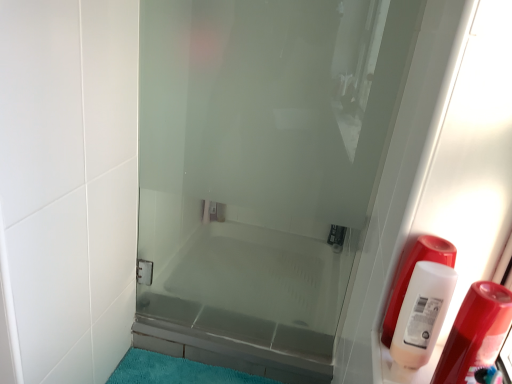
Question: Should I look upward or downward to see white plastic bottle at right?

Choices:
 (A) down
 (B) up

Answer: (A)

Question: Is transparent glass door at center not within white plastic bottle at right?

Choices:
 (A) no
 (B) yes

Answer: (B)

Question: Is the depth of transparent glass door at center greater than that of white plastic bottle at right?

Choices:
 (A) yes
 (B) no

Answer: (A)

Question: Is transparent glass door at center smaller than white plastic bottle at right?

Choices:
 (A) no
 (B) yes

Answer: (A)

Question: From a real-world perspective, is transparent glass door at center on white plastic bottle at right?

Choices:
 (A) no
 (B) yes

Answer: (A)

Question: Is transparent glass door at center oriented towards white plastic bottle at right?

Choices:
 (A) yes
 (B) no

Answer: (A)

Question: Considering the relative sizes of transparent glass door at center and white plastic bottle at right in the image provided, is transparent glass door at center thinner than white plastic bottle at right?

Choices:
 (A) no
 (B) yes

Answer: (B)

Question: Is the position of white plastic bottle at right less distant than that of white plastic bottle at right?

Choices:
 (A) no
 (B) yes

Answer: (B)

Question: From a real-world perspective, is white plastic bottle at right physically above white plastic bottle at right?

Choices:
 (A) no
 (B) yes

Answer: (B)

Question: Is white plastic bottle at right not close to white plastic bottle at right?

Choices:
 (A) no
 (B) yes

Answer: (A)

Question: Can you confirm if white plastic bottle at right is thinner than white plastic bottle at right?

Choices:
 (A) no
 (B) yes

Answer: (B)

Question: Is white plastic bottle at right located outside white plastic bottle at right?

Choices:
 (A) no
 (B) yes

Answer: (B)

Question: Is white plastic bottle at right shorter than white plastic bottle at right?

Choices:
 (A) no
 (B) yes

Answer: (A)

Question: Is white plastic bottle at right wider than teal plush bath mat at lower center?

Choices:
 (A) no
 (B) yes

Answer: (A)